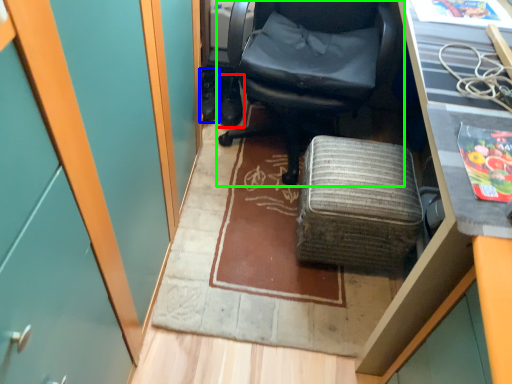
Question: Which object is positioned closest to footwear (highlighted by a red box)? Select from footwear (highlighted by a blue box) and chair (highlighted by a green box).

Choices:
 (A) footwear
 (B) chair

Answer: (A)